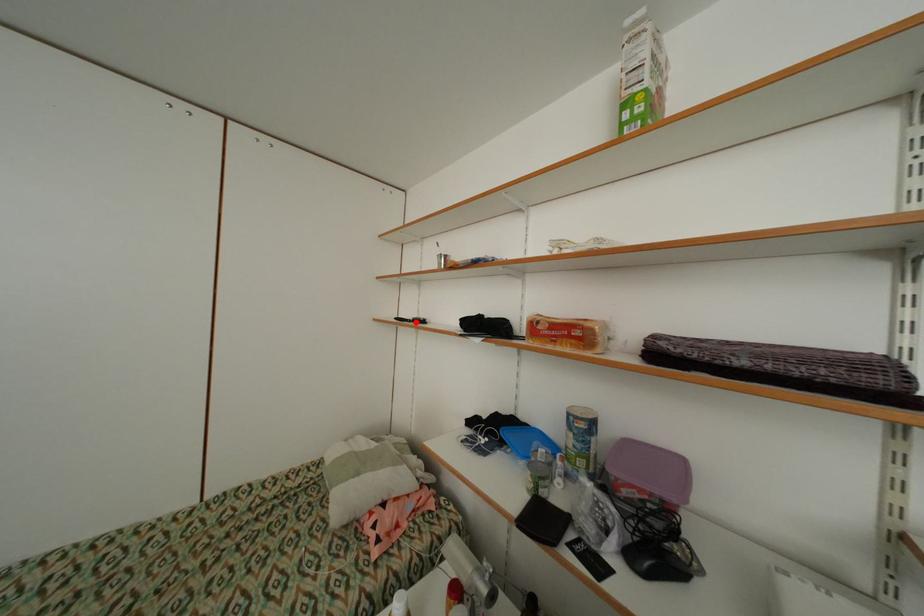
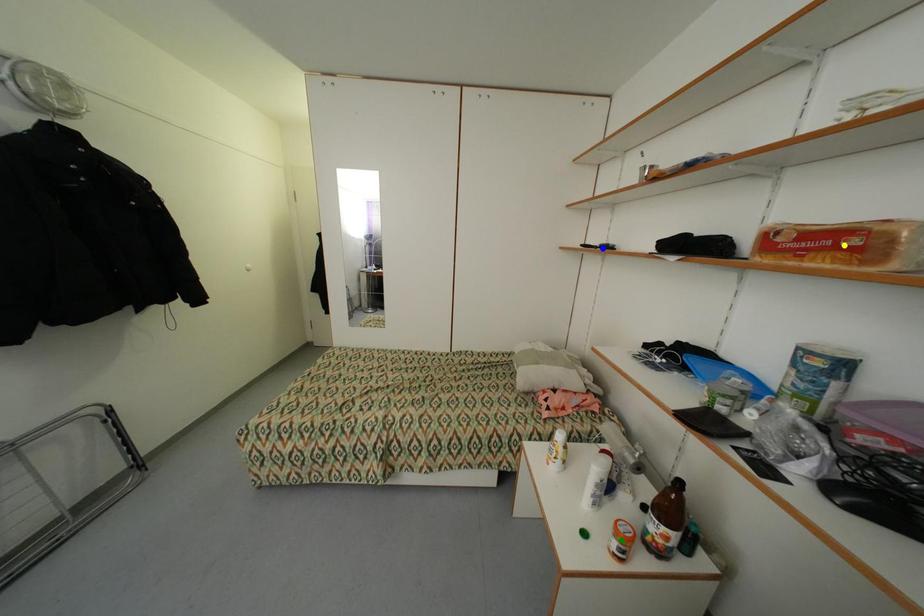
Question: I am providing you with two images of the same scene from different viewpoints. A red point is marked on the first image. You are given multiple points on the second image. Which mark in image 2 goes with the point in image 1?

Choices:
 (A) yellow point
 (B) blue point
 (C) green point

Answer: (B)